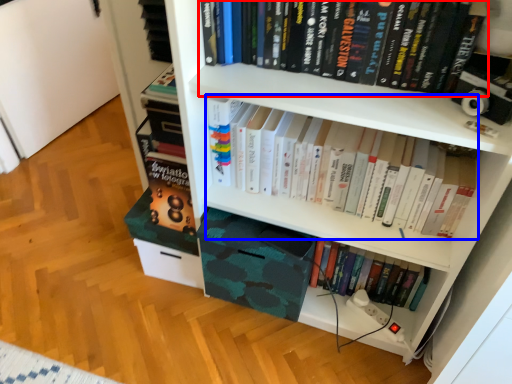
Question: Which object is further to the camera taking this photo, book (highlighted by a red box) or book (highlighted by a blue box)?

Choices:
 (A) book
 (B) book

Answer: (B)